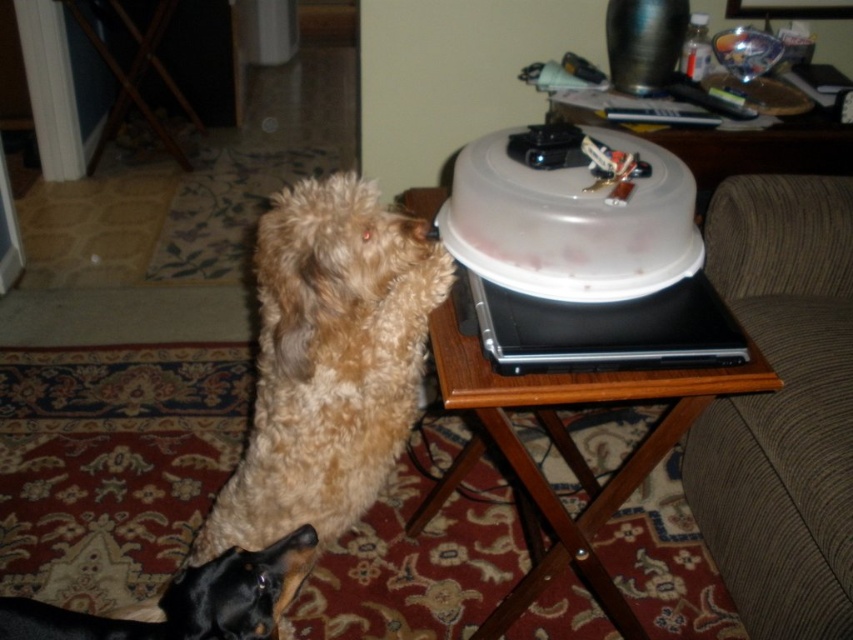
Question: Where is fuzzy brown dog at center located in relation to wooden side table at upper right in the image?

Choices:
 (A) right
 (B) left

Answer: (B)

Question: Is fuzzy brown dog at center to the right of black shiny dog at lower left from the viewer's perspective?

Choices:
 (A) no
 (B) yes

Answer: (B)

Question: Which of the following is the farthest from the observer?

Choices:
 (A) (393, 365)
 (B) (51, 611)

Answer: (A)

Question: Can you confirm if fuzzy brown dog at center is positioned to the left of wooden side table at upper right?

Choices:
 (A) no
 (B) yes

Answer: (B)

Question: Which point appears farthest from the camera in this image?

Choices:
 (A) (282, 544)
 (B) (260, 244)

Answer: (B)

Question: Which object is farther from the camera taking this photo?

Choices:
 (A) black shiny dog at lower left
 (B) fuzzy brown dog at center

Answer: (B)